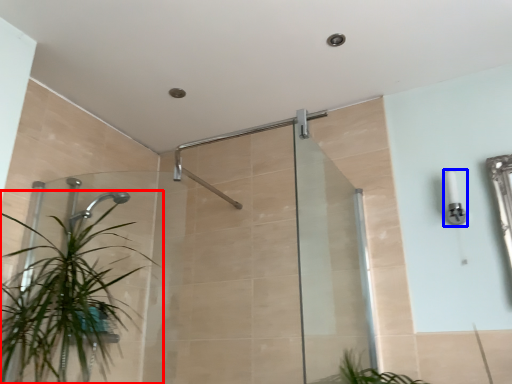
Question: Which object is closer to the camera taking this photo, houseplant (highlighted by a red box) or light fixture (highlighted by a blue box)?

Choices:
 (A) houseplant
 (B) light fixture

Answer: (A)